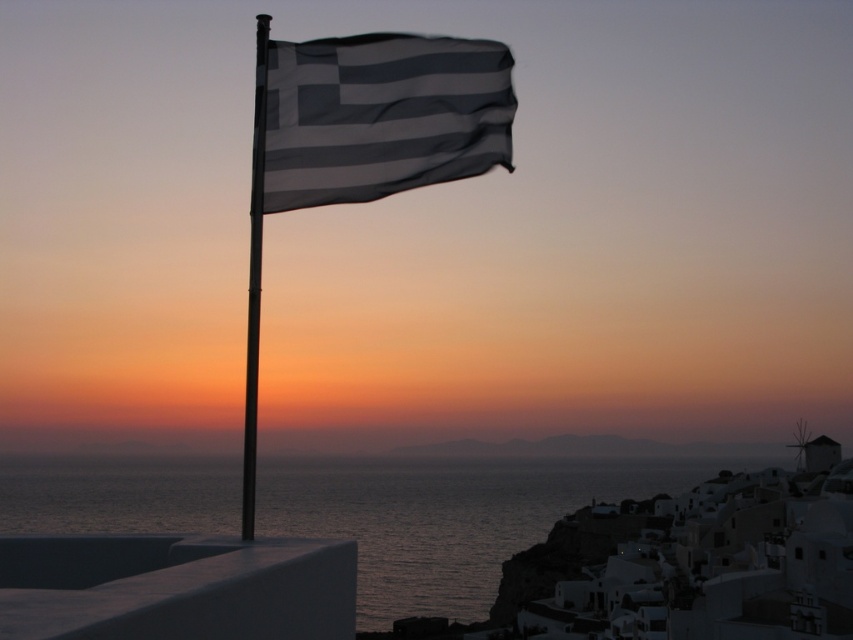
Question: Which object is the closest to the transparent water at lower left?

Choices:
 (A) metallic flag pole at upper left
 (B) dark gray fabric flag at center

Answer: (B)

Question: Is dark gray fabric flag at center above smooth concrete ledge at lower left?

Choices:
 (A) yes
 (B) no

Answer: (A)

Question: Among these points, which one is farthest from the camera?

Choices:
 (A) (341, 596)
 (B) (250, 356)
 (C) (357, 134)

Answer: (C)

Question: Estimate the real-world distances between objects in this image. Which object is closer to the dark gray fabric flag at center?

Choices:
 (A) transparent water at lower left
 (B) smooth concrete ledge at lower left

Answer: (B)

Question: Is the position of smooth concrete ledge at lower left more distant than that of metallic flag pole at upper left?

Choices:
 (A) yes
 (B) no

Answer: (B)

Question: From the image, what is the correct spatial relationship of transparent water at lower left in relation to smooth concrete ledge at lower left?

Choices:
 (A) below
 (B) above

Answer: (A)